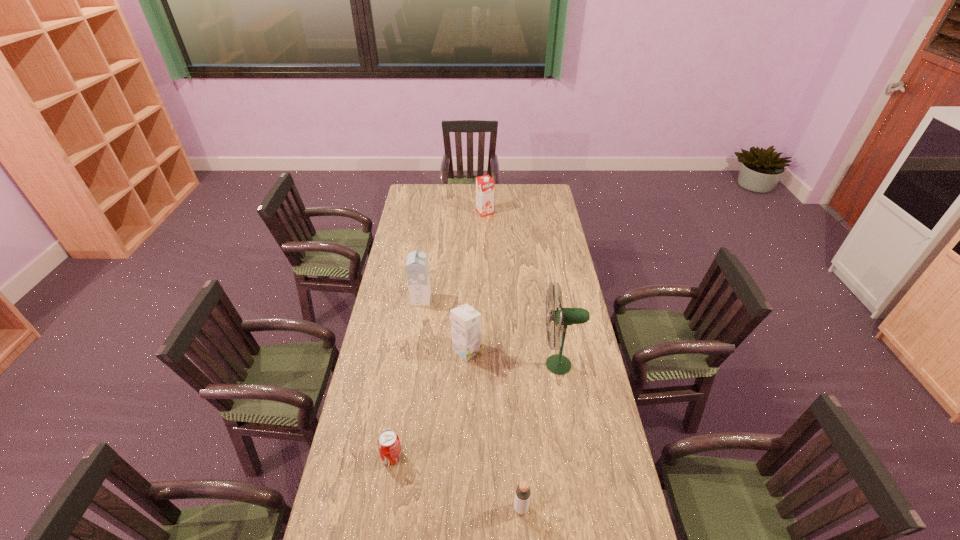
What are the coordinates of `object located in the right edge section of the desktop` in the screenshot? It's located at (558, 364).

This screenshot has height=540, width=960. I want to click on vacant area at the far edge of the desktop, so click(x=461, y=198).

Locate an element on the screen. This screenshot has width=960, height=540. vacant space at the left edge is located at coordinates (411, 250).

The height and width of the screenshot is (540, 960). Find the location of `free space at the right edge of the desktop`. free space at the right edge of the desktop is located at coordinates (599, 432).

The height and width of the screenshot is (540, 960). In the image, there is a desktop. Find the location of `vacant space at the far right corner`. vacant space at the far right corner is located at coordinates (546, 198).

You are a GUI agent. You are given a task and a screenshot of the screen. Output one action in this format:
    pyautogui.click(x=<x>, y=<y>)
    Task: Click on the free spot between the second shortest object and the farthest carton
    This screenshot has height=540, width=960.
    Given the screenshot: What is the action you would take?
    pyautogui.click(x=503, y=360)

Find the location of a particular element. Image resolution: width=960 pixels, height=540 pixels. free point between the nearest carton and the bottle is located at coordinates (494, 429).

Image resolution: width=960 pixels, height=540 pixels. Identify the location of vacant point located between the bottle and the fan. (540, 436).

The height and width of the screenshot is (540, 960). I want to click on free area in between the nearest object and the nearest carton, so click(x=494, y=429).

What are the coordinates of `free point between the nearest carton and the fifth nearest object` in the screenshot? It's located at point(444,325).